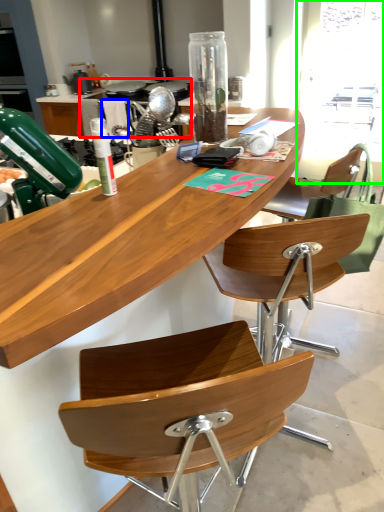
Question: Which object is positioned closest to appliance (highlighted by a red box)? Select from towel/napkin (highlighted by a blue box) and window screen (highlighted by a green box).

Choices:
 (A) towel/napkin
 (B) window screen

Answer: (A)